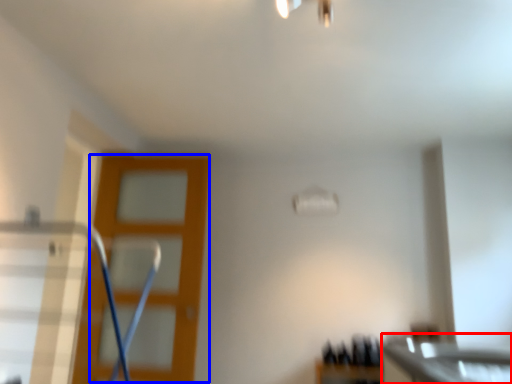
Question: Which point is closer to the camera, counter top (highlighted by a red box) or screen door (highlighted by a blue box)?

Choices:
 (A) counter top
 (B) screen door

Answer: (A)